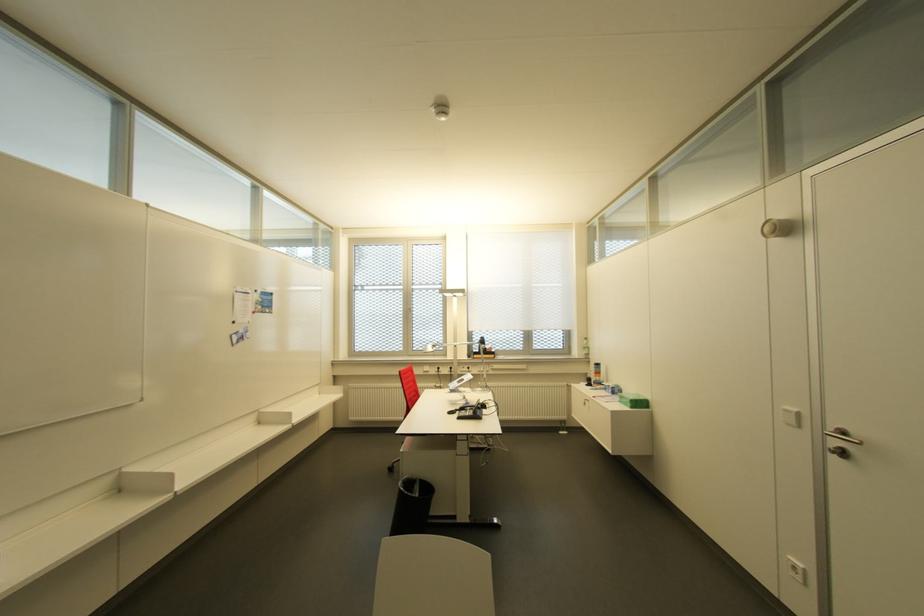
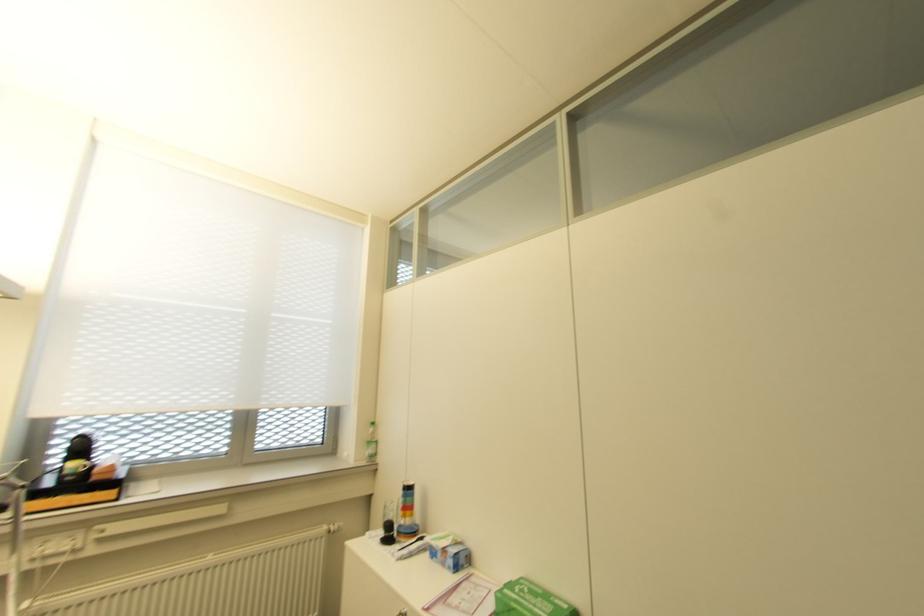
The point at (606, 387) is marked in the first image. Where is the corresponding point in the second image?

(441, 549)